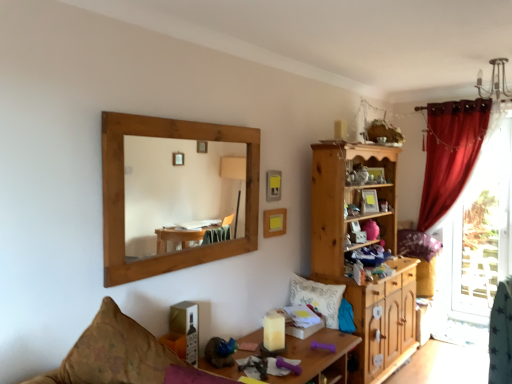
Identify the location of vacant area on top of wooden mirror at upper left (from a real-world perspective). (195, 119).